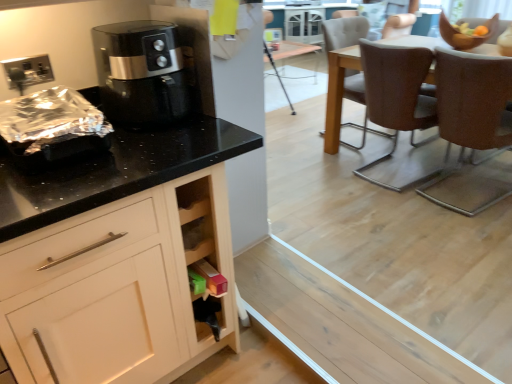
Identify the location of vacant area that is in front of brown textured chair at right, acting as the 1th chair starting from the back. (366, 153).